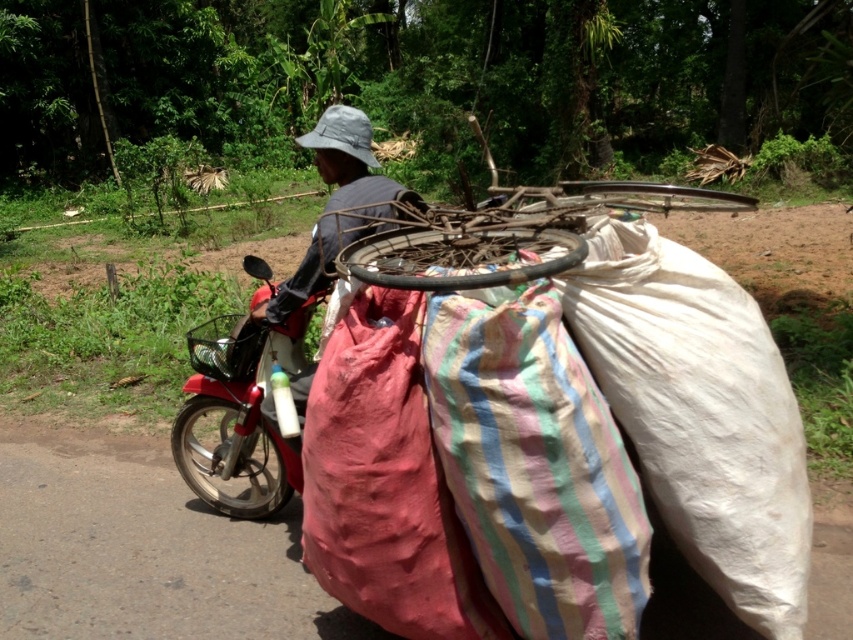
Between metallic red motorcycle at left and camouflage fabric hat at upper center, which one appears on the right side from the viewer's perspective?

camouflage fabric hat at upper center

Who is lower down, metallic red motorcycle at left or camouflage fabric hat at upper center?

metallic red motorcycle at left is lower down.

Who is more forward, (x=235, y=340) or (x=349, y=109)?

Point (x=349, y=109) is more forward.

You are a GUI agent. You are given a task and a screenshot of the screen. Output one action in this format:
    pyautogui.click(x=<x>, y=<y>)
    Task: Click on the metallic red motorcycle at left
    This screenshot has height=640, width=853.
    Given the screenshot: What is the action you would take?
    pyautogui.click(x=239, y=412)

Is point (466, 273) less distant than point (262, 500)?

Yes, it is.

Can you confirm if wooden bicycle wheel at center is positioned to the right of metallic red motorcycle at left?

Indeed, wooden bicycle wheel at center is positioned on the right side of metallic red motorcycle at left.

Identify the location of wooden bicycle wheel at center. Image resolution: width=853 pixels, height=640 pixels. (514, 232).

Between wooden bicycle wheel at center and camouflage fabric hat at upper center, which one appears on the right side from the viewer's perspective?

From the viewer's perspective, wooden bicycle wheel at center appears more on the right side.

Is point (421, 275) positioned after point (381, 177)?

No, (421, 275) is in front of (381, 177).

Find the location of a particular element. wooden bicycle wheel at center is located at coordinates (514, 232).